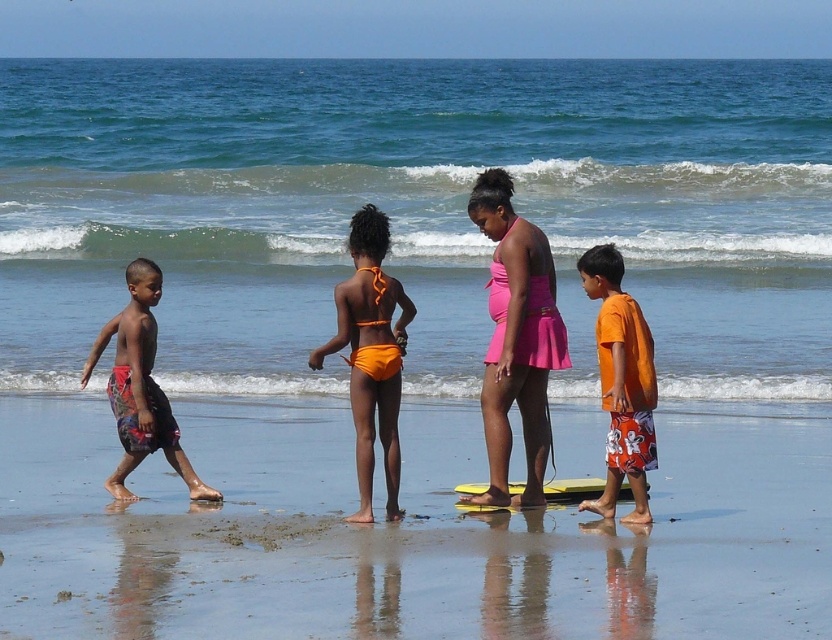
You are a photographer trying to capture a photo of the smooth sand at lower center and the multicolored printed shorts at left. Since you want both subjects to be in focus, you need to know which one is closer to the camera. Can you tell me which is closer?

The smooth sand at lower center is shorter than the multicolored printed shorts at left, so the smooth sand at lower center is closer to the camera.